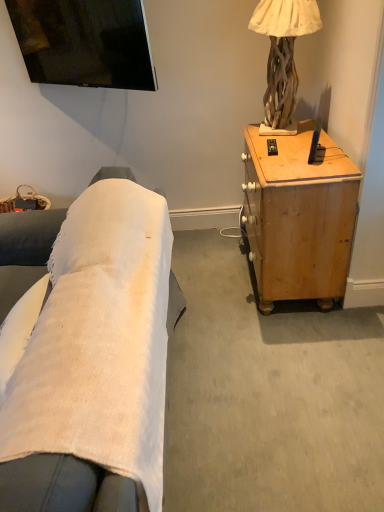
Question: Is black plastic remote control at upper right wider or thinner than light brown wood desk at right?

Choices:
 (A) wide
 (B) thin

Answer: (B)

Question: Relative to light brown wood desk at right, is black plastic remote control at upper right in front or behind?

Choices:
 (A) front
 (B) behind

Answer: (B)

Question: Which object is positioned closest to the natural wood lamp at upper right?

Choices:
 (A) light brown wood desk at right
 (B) black plastic remote control at upper right

Answer: (B)

Question: Which of these objects is positioned closest to the light brown wood desk at right?

Choices:
 (A) black plastic remote control at upper right
 (B) natural wood lamp at upper right

Answer: (A)